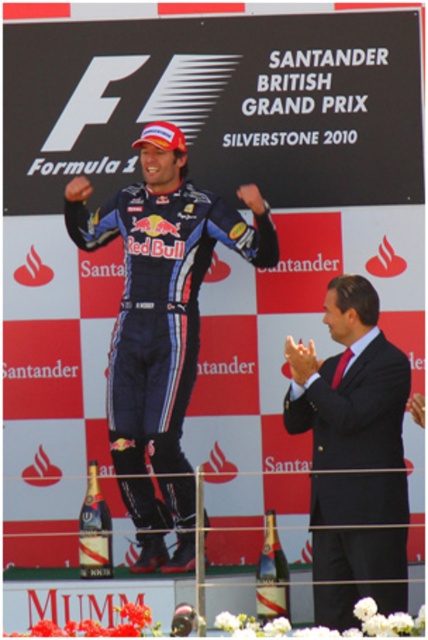
Which is more to the right, black suit at center or gold foil champagne bottle at center?

From the viewer's perspective, black suit at center appears more on the right side.

Is black suit at center further to camera compared to gold foil champagne bottle at center?

That is False.

Between point (351, 616) and point (101, 522), which one is positioned behind?

The point (101, 522) is behind.

Find the location of a particular element. black suit at center is located at coordinates (350, 385).

Does shiny blue suit at center have a lesser height compared to black suit at center?

In fact, shiny blue suit at center may be taller than black suit at center.

From the picture: Is shiny blue suit at center to the left of black suit at center from the viewer's perspective?

Yes, shiny blue suit at center is to the left of black suit at center.

Find the location of a particular element. This screenshot has width=428, height=640. shiny blue suit at center is located at coordinates (160, 324).

Locate an element on the screen. This screenshot has width=428, height=640. shiny blue suit at center is located at coordinates (160, 324).

How much distance is there between black suit at center and translucent glass bottle at center?

8.80 feet

Which of these two, black suit at center or translucent glass bottle at center, stands shorter?

With less height is translucent glass bottle at center.

At what (x,y) coordinates should I click in order to perform the action: click on black suit at center. Please return your answer as a coordinate pair (x, y). Looking at the image, I should click on (350, 385).